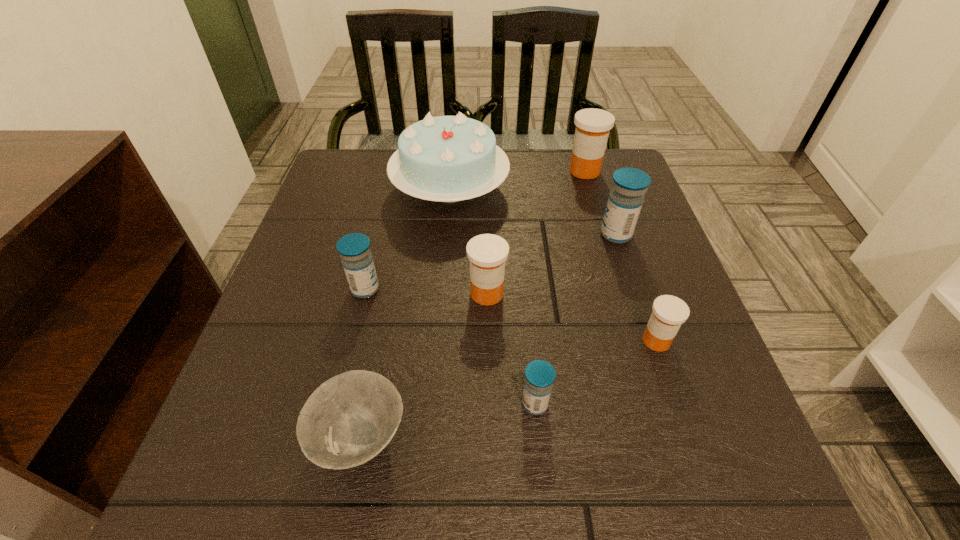
You are a GUI agent. You are given a task and a screenshot of the screen. Output one action in this format:
    pyautogui.click(x=<x>, y=<y>)
    Task: Click on the free area in between the bowl and the second smallest orange medicine
    Image resolution: width=960 pixels, height=540 pixels.
    Given the screenshot: What is the action you would take?
    pyautogui.click(x=423, y=366)

This screenshot has height=540, width=960. I want to click on vacant area between the second biggest orange medicine and the nearest orange medicine, so click(x=571, y=317).

Find the location of a particular element. free area in between the shortest object and the second blue medicine from left to right is located at coordinates (447, 421).

Where is `vacant point located between the second medicine from left to right and the shortest object`? Image resolution: width=960 pixels, height=540 pixels. vacant point located between the second medicine from left to right and the shortest object is located at coordinates (423, 366).

Locate an element on the screen. Image resolution: width=960 pixels, height=540 pixels. free space between the second smallest orange medicine and the farthest orange medicine is located at coordinates (x=536, y=232).

Find the location of a particular element. empty location between the shortest object and the second nearest orange medicine is located at coordinates (423, 366).

Find the location of a particular element. The image size is (960, 540). vacant space in between the smallest orange medicine and the smallest blue medicine is located at coordinates (595, 372).

Identify the location of free space between the nearest orange medicine and the leftmost medicine. (511, 315).

This screenshot has width=960, height=540. Identify the location of vacant point located between the smallest orange medicine and the second smallest blue medicine. [511, 315].

Locate which object ranks second in proximity to the blue birthday cake. Please provide its 2D coordinates. Your answer should be formatted as a tuple, i.e. [(x, y)], where the tuple contains the x and y coordinates of a point satisfying the conditions above.

[(354, 249)]